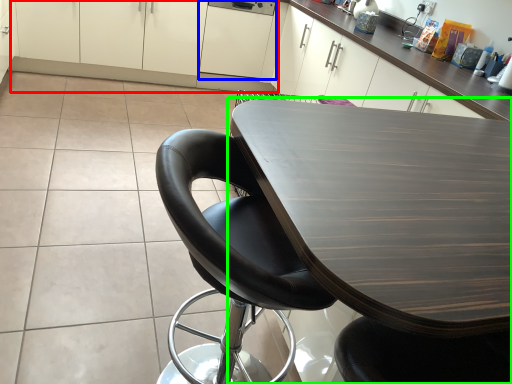
Question: Which is nearer to the cabinetry (highlighted by a red box)? cabinetry (highlighted by a blue box) or table (highlighted by a green box).

Choices:
 (A) cabinetry
 (B) table

Answer: (A)